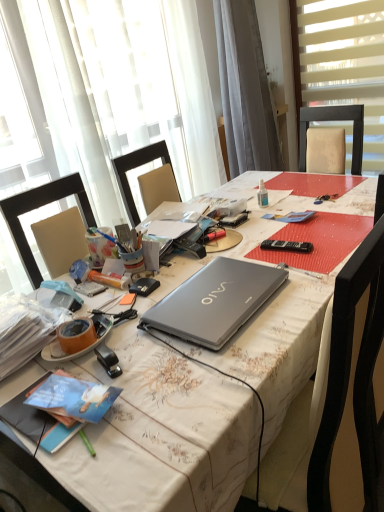
This screenshot has height=512, width=384. Identify the location of free space in front of silver metallic laptop at center. (216, 369).